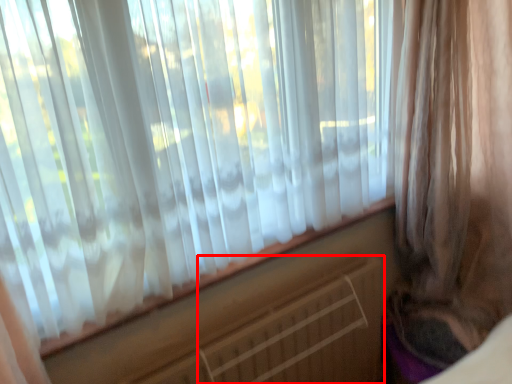
Question: From the image's perspective, what is the correct spatial positioning of radiator (annotated by the red box) in reference to curtain?

Choices:
 (A) below
 (B) above

Answer: (A)